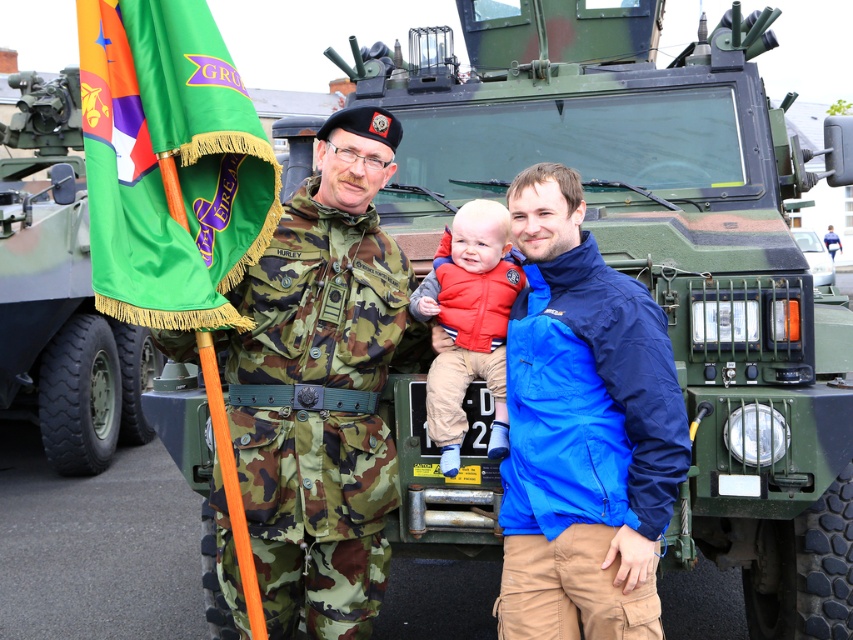
Between green fabric flag at left and green camouflage tank at left, which one is positioned lower?

green camouflage tank at left is lower down.

Is green fabric flag at left below green camouflage tank at left?

Incorrect, green fabric flag at left is not positioned below green camouflage tank at left.

Is point (161, 150) farther from camera compared to point (3, 273)?

No.

Find the location of a particular element. This screenshot has width=853, height=640. green fabric flag at left is located at coordinates (170, 161).

Can you confirm if blue fabric jacket at center is thinner than camouflage fabric uniform at center?

Correct, blue fabric jacket at center's width is less than camouflage fabric uniform at center's.

Who is more forward, [639,452] or [833,240]?

Positioned in front is point [639,452].

Locate an element on the screen. blue fabric jacket at center is located at coordinates (585, 448).

The height and width of the screenshot is (640, 853). What do you see at coordinates (318, 413) in the screenshot?
I see `camouflage fabric uniform at left` at bounding box center [318, 413].

Can you confirm if camouflage fabric uniform at left is positioned below red fleece vest at center?

Indeed, camouflage fabric uniform at left is positioned under red fleece vest at center.

Measure the distance between point (286, 401) and camera.

Point (286, 401) and camera are 3.22 meters apart.

Find the location of `camouflage fabric uniform at left`. camouflage fabric uniform at left is located at coordinates (318, 413).